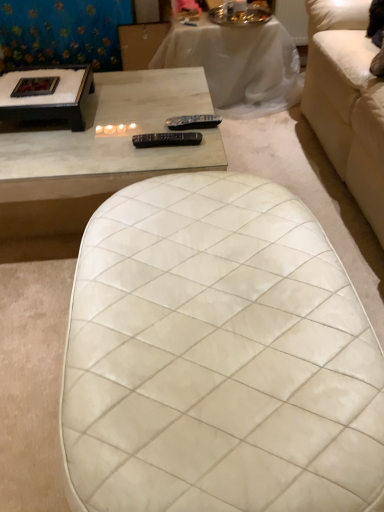
Locate an element on the screen. free space to the right of black wood coffee table at upper left, which ranks as the second coffee table in right-to-left order is located at coordinates (129, 117).